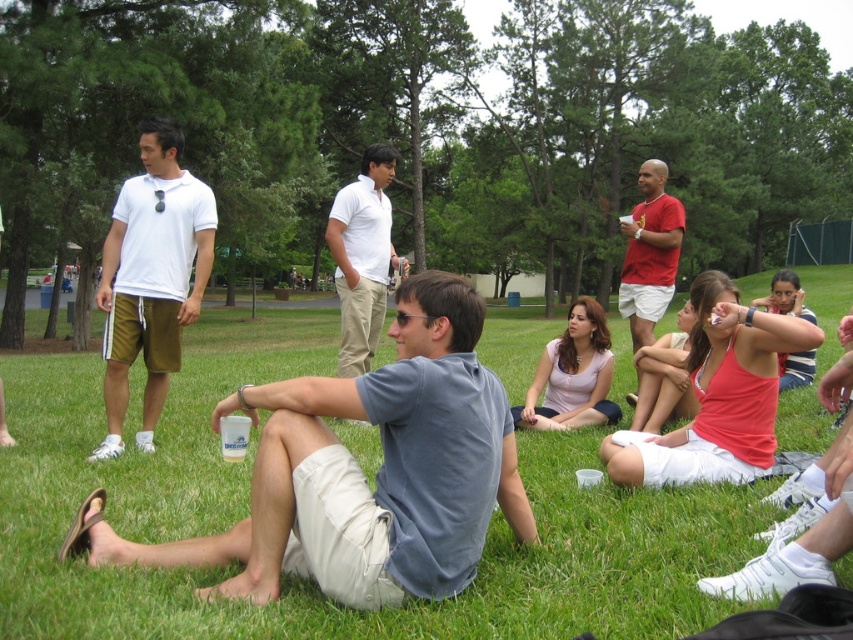
Based on the scene description, where is the white cotton polo shirt at left located in the image?

The white cotton polo shirt at left is located at point 0.434 on the x axis and 0.178 on the y axis.

In the scene shown: You are standing at the camera position and want to throw a ball to one of the two points marked in the image. Which point, point (105, 275) or point (668, 244), is closer to you?

Point (105, 275) is closer to you than point (668, 244).